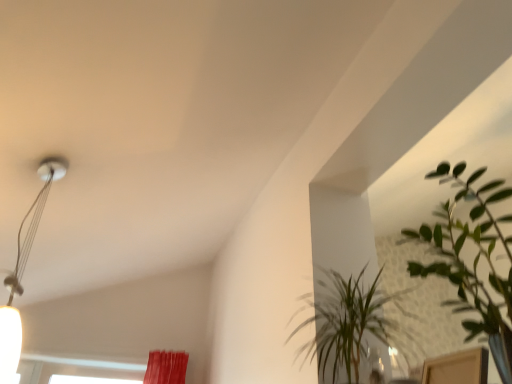
What do you see at coordinates (472, 262) in the screenshot? I see `green leafy plant at upper right, the first houseplant in the front-to-back sequence` at bounding box center [472, 262].

Looking at this image, in order to face metallic silver lamp at upper left, should I rotate leftwards or rightwards?

Rotate left and turn 28.862 degrees.

Where is `green leafy plant at upper right, the 1th houseplant in the back-to-front sequence`? The image size is (512, 384). green leafy plant at upper right, the 1th houseplant in the back-to-front sequence is located at coordinates (346, 322).

Describe the element at coordinates (346, 322) in the screenshot. I see `green leafy plant at upper right, acting as the second houseplant starting from the front` at that location.

I want to click on green leafy plant at upper right, the first houseplant in the front-to-back sequence, so click(x=472, y=262).

Does metallic silver lamp at upper left come behind green leafy plant at upper right, the 2th houseplant viewed from the back?

Yes, it is.

Does point (48, 172) come closer to viewer compared to point (476, 232)?

No, it is behind (476, 232).

Which is correct: metallic silver lamp at upper left is inside green leafy plant at upper right, the 2th houseplant viewed from the back, or outside of it?

metallic silver lamp at upper left is located beyond the bounds of green leafy plant at upper right, the 2th houseplant viewed from the back.

Is point (413, 314) farther from viewer compared to point (471, 193)?

Yes, it is behind point (471, 193).

Is green leafy plant at upper right, the 1th houseplant in the back-to-front sequence, taller than green leafy plant at upper right, the first houseplant in the front-to-back sequence?

No.

Which of these two, green leafy plant at upper right, acting as the second houseplant starting from the front, or green leafy plant at upper right, the first houseplant in the front-to-back sequence, is thinner?

Thinner between the two is green leafy plant at upper right, acting as the second houseplant starting from the front.

Which is correct: green leafy plant at upper right, the 1th houseplant in the back-to-front sequence, is inside green leafy plant at upper right, the 2th houseplant viewed from the back, or outside of it?

green leafy plant at upper right, the 1th houseplant in the back-to-front sequence, is not enclosed by green leafy plant at upper right, the 2th houseplant viewed from the back.

From the image's perspective, is metallic silver lamp at upper left located above green leafy plant at upper right, acting as the second houseplant starting from the front?

Yes, from the image's perspective, metallic silver lamp at upper left is above green leafy plant at upper right, acting as the second houseplant starting from the front.

Can green leafy plant at upper right, acting as the second houseplant starting from the front, be found inside metallic silver lamp at upper left?

No.

In the scene shown: Which object is further away from the camera taking this photo, metallic silver lamp at upper left or green leafy plant at upper right, acting as the second houseplant starting from the front?

metallic silver lamp at upper left is further away from the camera.

In terms of size, does metallic silver lamp at upper left appear bigger or smaller than green leafy plant at upper right, acting as the second houseplant starting from the front?

Considering their sizes, metallic silver lamp at upper left takes up less space than green leafy plant at upper right, acting as the second houseplant starting from the front.

How much distance is there between green leafy plant at upper right, the first houseplant in the front-to-back sequence, and metallic silver lamp at upper left?

The distance of green leafy plant at upper right, the first houseplant in the front-to-back sequence, from metallic silver lamp at upper left is 1.52 meters.

Is green leafy plant at upper right, the first houseplant in the front-to-back sequence, in front of or behind metallic silver lamp at upper left in the image?

Clearly, green leafy plant at upper right, the first houseplant in the front-to-back sequence, is in front of metallic silver lamp at upper left.

Looking at the image, does green leafy plant at upper right, the 2th houseplant viewed from the back, seem bigger or smaller compared to metallic silver lamp at upper left?

green leafy plant at upper right, the 2th houseplant viewed from the back, is bigger than metallic silver lamp at upper left.

The width and height of the screenshot is (512, 384). Find the location of `lamp located above the green leafy plant at upper right, the first houseplant in the front-to-back sequence (from a real-world perspective)`. lamp located above the green leafy plant at upper right, the first houseplant in the front-to-back sequence (from a real-world perspective) is located at coordinates (24, 269).

Is green leafy plant at upper right, acting as the second houseplant starting from the front, taller than metallic silver lamp at upper left?

No, green leafy plant at upper right, acting as the second houseplant starting from the front, is not taller than metallic silver lamp at upper left.

In the scene shown: From the image's perspective, between green leafy plant at upper right, acting as the second houseplant starting from the front, and metallic silver lamp at upper left, which one is located above?

metallic silver lamp at upper left appears higher in the image.

Identify the location of lamp behind the green leafy plant at upper right, acting as the second houseplant starting from the front. (24, 269).

Looking at this image, which object is closer to the camera, green leafy plant at upper right, acting as the second houseplant starting from the front, or metallic silver lamp at upper left?

green leafy plant at upper right, acting as the second houseplant starting from the front, is in front.

From a real-world perspective, relative to green leafy plant at upper right, acting as the second houseplant starting from the front, is green leafy plant at upper right, the first houseplant in the front-to-back sequence, vertically above or below?

green leafy plant at upper right, the first houseplant in the front-to-back sequence, is situated lower than green leafy plant at upper right, acting as the second houseplant starting from the front, in the real world.

Which of these two, green leafy plant at upper right, the 2th houseplant viewed from the back, or green leafy plant at upper right, the 1th houseplant in the back-to-front sequence, is bigger?

green leafy plant at upper right, the 2th houseplant viewed from the back.

From their relative heights in the image, would you say green leafy plant at upper right, the first houseplant in the front-to-back sequence, is taller or shorter than green leafy plant at upper right, the 1th houseplant in the back-to-front sequence?

In the image, green leafy plant at upper right, the first houseplant in the front-to-back sequence, appears to be taller than green leafy plant at upper right, the 1th houseplant in the back-to-front sequence.

Between point (443, 181) and point (358, 346), which one is positioned in front?

Point (358, 346)

You are a GUI agent. You are given a task and a screenshot of the screen. Output one action in this format:
    pyautogui.click(x=<x>, y=<y>)
    Task: Click on the lamp to the left of green leafy plant at upper right, the 2th houseplant viewed from the back
    The height and width of the screenshot is (384, 512).
    Given the screenshot: What is the action you would take?
    pyautogui.click(x=24, y=269)

Identify the location of houseplant in front of the green leafy plant at upper right, the 1th houseplant in the back-to-front sequence. (472, 262).

From the image, which object appears to be farther from metallic silver lamp at upper left, green leafy plant at upper right, the first houseplant in the front-to-back sequence, or green leafy plant at upper right, acting as the second houseplant starting from the front?

Among the two, green leafy plant at upper right, the first houseplant in the front-to-back sequence, is located further to metallic silver lamp at upper left.

Looking at the image, which one is located further to green leafy plant at upper right, the 1th houseplant in the back-to-front sequence, green leafy plant at upper right, the first houseplant in the front-to-back sequence, or metallic silver lamp at upper left?

metallic silver lamp at upper left is positioned further to the anchor green leafy plant at upper right, the 1th houseplant in the back-to-front sequence.

Looking at the image, which one is located closer to metallic silver lamp at upper left, green leafy plant at upper right, acting as the second houseplant starting from the front, or green leafy plant at upper right, the first houseplant in the front-to-back sequence?

Among the two, green leafy plant at upper right, acting as the second houseplant starting from the front, is located nearer to metallic silver lamp at upper left.

When comparing their distances from green leafy plant at upper right, the 2th houseplant viewed from the back, does metallic silver lamp at upper left or green leafy plant at upper right, acting as the second houseplant starting from the front, seem further?

metallic silver lamp at upper left is further to green leafy plant at upper right, the 2th houseplant viewed from the back.

From the image, which object appears to be nearer to green leafy plant at upper right, the first houseplant in the front-to-back sequence, green leafy plant at upper right, the 1th houseplant in the back-to-front sequence, or metallic silver lamp at upper left?

green leafy plant at upper right, the 1th houseplant in the back-to-front sequence, is positioned closer to the anchor green leafy plant at upper right, the first houseplant in the front-to-back sequence.

Based on their spatial positions, is metallic silver lamp at upper left or green leafy plant at upper right, the 2th houseplant viewed from the back, further from green leafy plant at upper right, the 1th houseplant in the back-to-front sequence?

metallic silver lamp at upper left lies further to green leafy plant at upper right, the 1th houseplant in the back-to-front sequence, than the other object.

Image resolution: width=512 pixels, height=384 pixels. Identify the location of houseplant between metallic silver lamp at upper left and green leafy plant at upper right, the 2th houseplant viewed from the back. (346, 322).